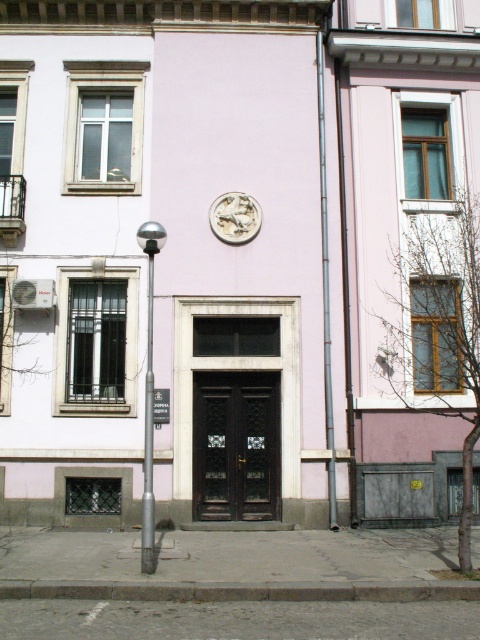
Who is lower down, metallic gray pipe at center or metallic silver pole at center?

metallic gray pipe at center is below.

Is the position of metallic gray pipe at center more distant than that of metallic silver pole at center?

Yes, it is.

Does point (322, 200) come farther from viewer compared to point (151, 481)?

That is True.

Locate an element on the screen. metallic gray pipe at center is located at coordinates (325, 285).

Who is lower down, silver metallic coin at center or white plastic sign at center?

Positioned lower is white plastic sign at center.

Does silver metallic coin at center appear over white plastic sign at center?

Yes, silver metallic coin at center is above white plastic sign at center.

Image resolution: width=480 pixels, height=640 pixels. Describe the element at coordinates (235, 218) in the screenshot. I see `silver metallic coin at center` at that location.

Image resolution: width=480 pixels, height=640 pixels. Identify the location of silver metallic coin at center. (235, 218).

Does metallic silver pole at center appear under white plastic sign at center?

Correct, metallic silver pole at center is located below white plastic sign at center.

Can you confirm if metallic silver pole at center is bigger than white plastic sign at center?

No.

Is point (152, 467) positioned in front of point (162, 403)?

That is True.

Identify the location of metallic silver pole at center. (148, 432).